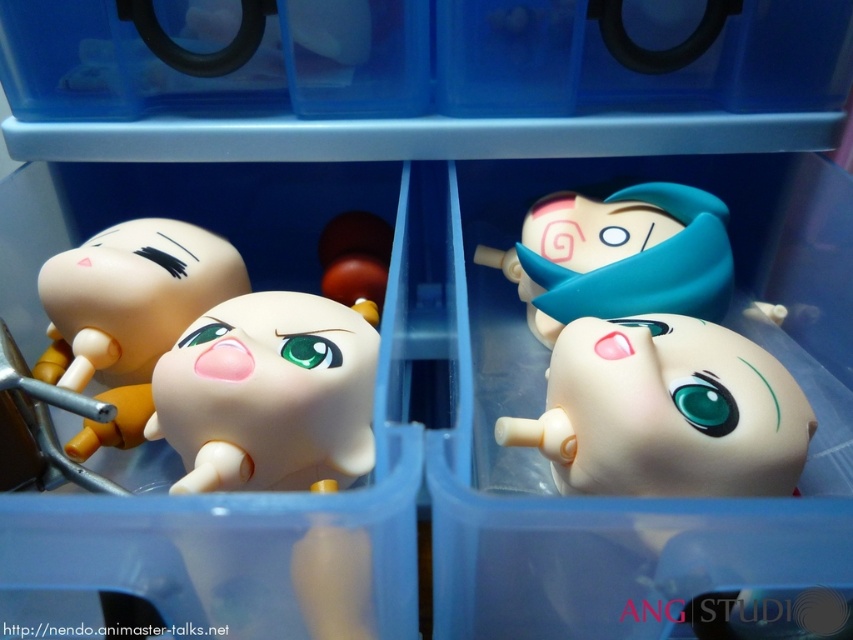
Question: Which object is positioned closest to the matte white figure at upper right?

Choices:
 (A) white glossy figurine at center
 (B) matte plastic toy at center

Answer: (A)

Question: Is white glossy figurine at center smaller than matte plastic toy at center?

Choices:
 (A) no
 (B) yes

Answer: (B)

Question: Is white glossy figurine at center thinner than matte plastic toy at center?

Choices:
 (A) yes
 (B) no

Answer: (A)

Question: Can you confirm if white glossy figurine at center is positioned above matte white figure at upper right?

Choices:
 (A) yes
 (B) no

Answer: (B)

Question: Which is nearer to the white glossy figurine at center?

Choices:
 (A) matte plastic toy at center
 (B) matte white figure at upper right

Answer: (A)

Question: Which object is farther from the camera taking this photo?

Choices:
 (A) matte plastic toy at center
 (B) matte white figure at upper right
 (C) white glossy figurine at center

Answer: (B)